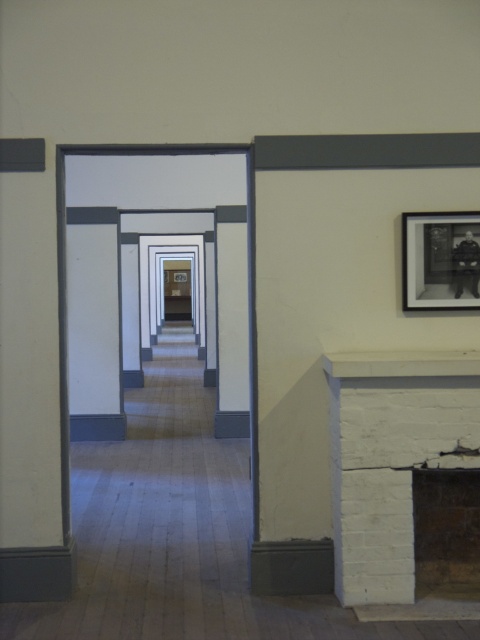
Question: Observing the image, what is the correct spatial positioning of white painted brick fireplace at lower right in reference to black matte picture frame at upper right?

Choices:
 (A) right
 (B) left

Answer: (B)

Question: Which point is farther to the camera?

Choices:
 (A) black matte picture frame at upper right
 (B) white painted brick fireplace at lower right

Answer: (A)

Question: Does white painted brick fireplace at lower right appear on the right side of black matte picture frame at upper right?

Choices:
 (A) yes
 (B) no

Answer: (B)

Question: Which object is closer to the camera taking this photo?

Choices:
 (A) black matte picture frame at upper right
 (B) white painted brick fireplace at lower right

Answer: (B)

Question: Is white painted brick fireplace at lower right positioned at the back of black matte picture frame at upper right?

Choices:
 (A) yes
 (B) no

Answer: (B)